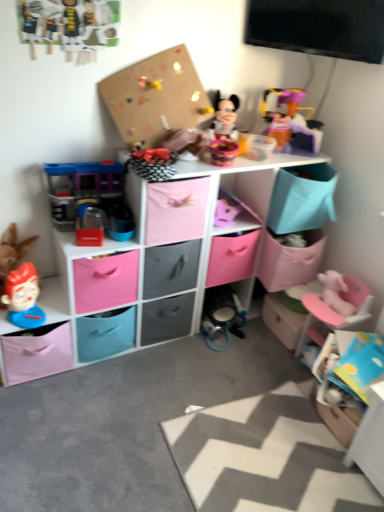
Locate an element on the screen. free space that is in between wooden toy at lower right, which is the 2th storage box in right-to-left order, and pink plastic swivel chair at lower right is located at coordinates (271, 342).